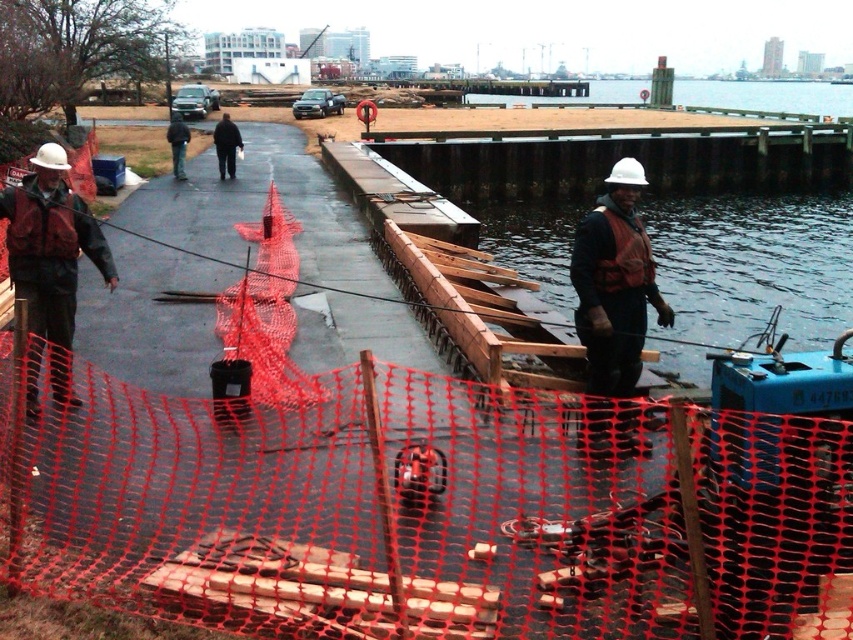
Does white hard hat at center have a lesser height compared to matte black jacket at left?

In fact, white hard hat at center may be taller than matte black jacket at left.

Which is behind, point (608, 392) or point (38, 289)?

The point (38, 289) is more distant.

Is point (619, 348) closer to viewer compared to point (57, 273)?

Yes, it is in front of point (57, 273).

In order to click on white hard hat at center in this screenshot , I will do `click(614, 284)`.